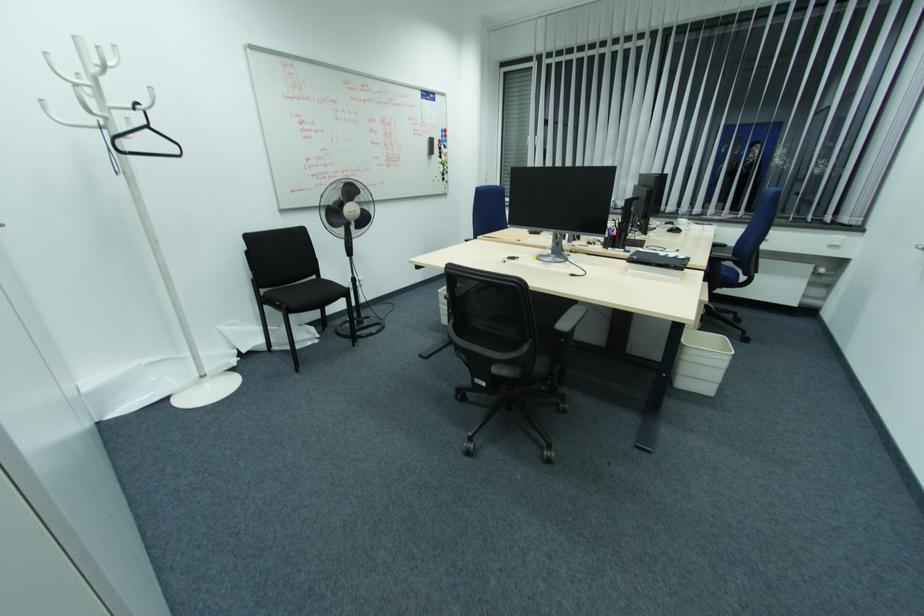
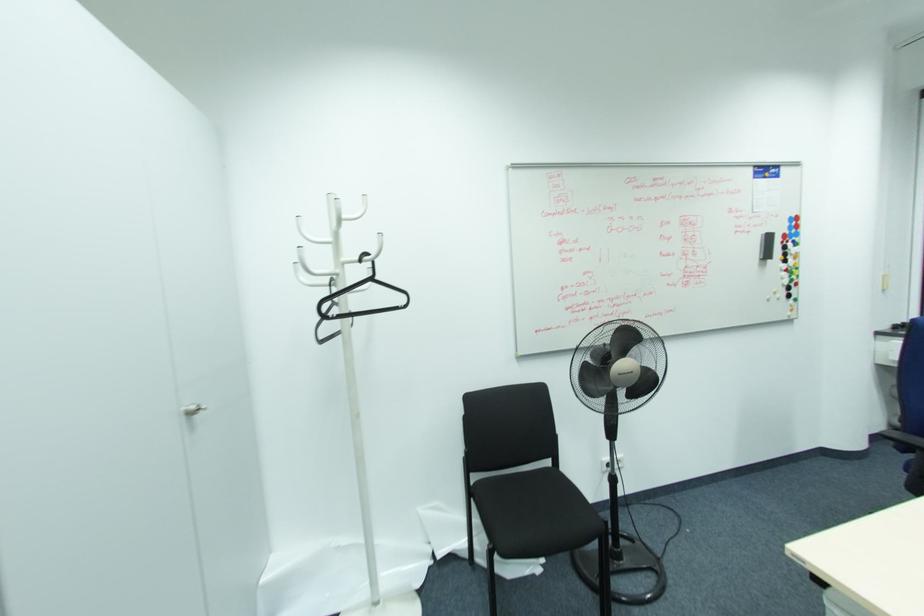
Find the pixel in the second image that matches point 441,148 in the first image.

(785, 248)